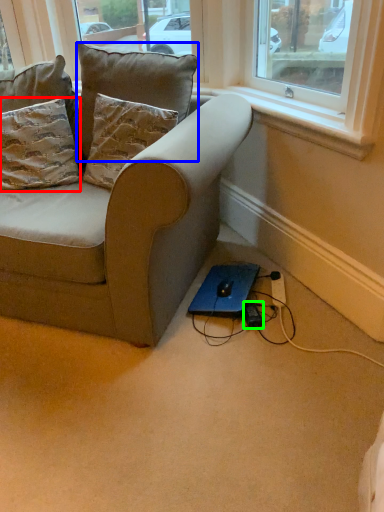
Question: Which object is the farthest from pillow (highlighted by a red box)? Choose among these: pillow (highlighted by a blue box) or plug (highlighted by a green box).

Choices:
 (A) pillow
 (B) plug

Answer: (B)